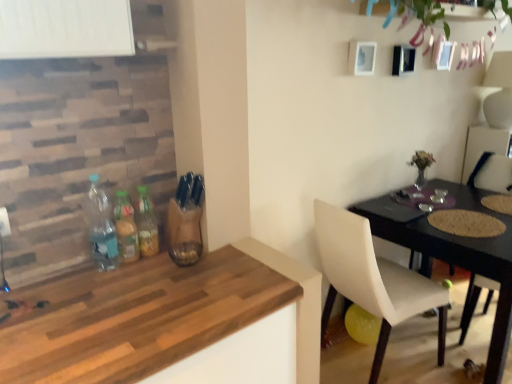
Question: Is green leafy plant at upper center positioned with its back to wooden table at lower left?

Choices:
 (A) yes
 (B) no

Answer: (B)

Question: Is wooden table at lower left located within green leafy plant at upper center?

Choices:
 (A) no
 (B) yes

Answer: (A)

Question: Can you confirm if green leafy plant at upper center is wider than wooden table at lower left?

Choices:
 (A) yes
 (B) no

Answer: (B)

Question: Is green leafy plant at upper center far away from wooden table at lower left?

Choices:
 (A) yes
 (B) no

Answer: (A)

Question: Is the position of green leafy plant at upper center less distant than that of wooden table at lower left?

Choices:
 (A) no
 (B) yes

Answer: (A)

Question: Choose the correct answer: Is green leafy plant at upper center inside wooden textured chair at right, which is the first chair in right-to-left order, or outside it?

Choices:
 (A) outside
 (B) inside

Answer: (A)

Question: Based on their sizes in the image, would you say green leafy plant at upper center is bigger or smaller than wooden textured chair at right, positioned as the second chair in left-to-right order?

Choices:
 (A) small
 (B) big

Answer: (A)

Question: Does point (504, 3) appear closer or farther from the camera than point (490, 284)?

Choices:
 (A) farther
 (B) closer

Answer: (A)

Question: Is green leafy plant at upper center taller or shorter than wooden textured chair at right, which is the first chair in right-to-left order?

Choices:
 (A) tall
 (B) short

Answer: (B)

Question: From their relative heights in the image, would you say green leafy plant at upper center is taller or shorter than translucent glass bottles at center, the third bottle viewed from the left?

Choices:
 (A) short
 (B) tall

Answer: (A)

Question: From the image's perspective, is green leafy plant at upper center above or below translucent glass bottles at center, which appears as the first bottle when viewed from the right?

Choices:
 (A) above
 (B) below

Answer: (A)

Question: In the image, is green leafy plant at upper center positioned in front of or behind translucent glass bottles at center, the third bottle viewed from the left?

Choices:
 (A) behind
 (B) front

Answer: (A)

Question: Does point (492, 9) appear closer or farther from the camera than point (143, 249)?

Choices:
 (A) closer
 (B) farther

Answer: (B)

Question: Is translucent glass bottles at center, which appears as the first bottle when viewed from the right, inside or outside of green leafy plant at upper center?

Choices:
 (A) outside
 (B) inside

Answer: (A)

Question: Is translucent glass bottles at center, which appears as the first bottle when viewed from the right, bigger or smaller than green leafy plant at upper center?

Choices:
 (A) small
 (B) big

Answer: (A)